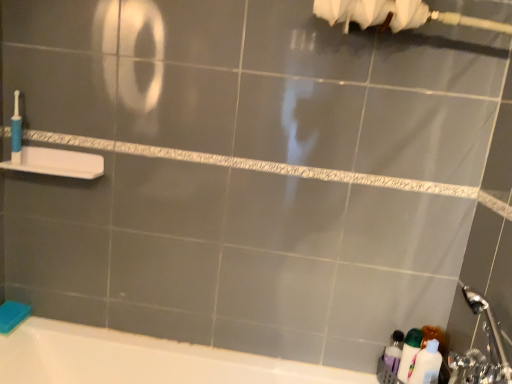
Describe the element at coordinates (57, 163) in the screenshot. The height and width of the screenshot is (384, 512). I see `white plastic shelf at left` at that location.

Where is `blue plastic toothbrush at left`? Image resolution: width=512 pixels, height=384 pixels. blue plastic toothbrush at left is located at coordinates (16, 131).

This screenshot has height=384, width=512. What do you see at coordinates (426, 364) in the screenshot?
I see `translucent plastic bottles at lower right` at bounding box center [426, 364].

Image resolution: width=512 pixels, height=384 pixels. Identify the location of white glossy bottle at lower right. (409, 352).

Could you tell me if blue plastic toothbrush at left is turned towards white glossy bottle at lower right?

No, blue plastic toothbrush at left is not oriented towards white glossy bottle at lower right.

Is blue plastic toothbrush at left to the left of white glossy bottle at lower right from the viewer's perspective?

Indeed, blue plastic toothbrush at left is positioned on the left side of white glossy bottle at lower right.

Considering their positions, is blue plastic toothbrush at left located in front of or behind white glossy bottle at lower right?

Visually, blue plastic toothbrush at left is located behind white glossy bottle at lower right.

Which of these two, white glossy bottle at lower right or white plastic shelf at left, is thinner?

Thinner between the two is white glossy bottle at lower right.

In the scene shown: Is white glossy bottle at lower right to the left of white plastic shelf at left from the viewer's perspective?

No.

Is white glossy bottle at lower right behind white plastic shelf at left?

No, white glossy bottle at lower right is closer to the viewer.

Between point (411, 337) and point (80, 155), which one is positioned behind?

The point (80, 155) is farther from the camera.

Is blue plastic toothbrush at left oriented away from translucent plastic bottles at lower right?

No, blue plastic toothbrush at left is not facing the opposite direction of translucent plastic bottles at lower right.

From a real-world perspective, between blue plastic toothbrush at left and translucent plastic bottles at lower right, who is vertically lower?

translucent plastic bottles at lower right is physically lower.

Is blue plastic toothbrush at left thinner than translucent plastic bottles at lower right?

Yes.

Can you tell me how much blue plastic toothbrush at left and translucent plastic bottles at lower right differ in facing direction?

The angular difference between blue plastic toothbrush at left and translucent plastic bottles at lower right is 18 degrees.

Which is more to the left, translucent plastic bottles at lower right or blue plastic toothbrush at left?

Positioned to the left is blue plastic toothbrush at left.

What are the coordinates of `toiletry on the right of the blue plastic toothbrush at left` in the screenshot? It's located at (426, 364).

Does translucent plastic bottles at lower right have a lesser height compared to blue plastic toothbrush at left?

In fact, translucent plastic bottles at lower right may be taller than blue plastic toothbrush at left.

Is translucent plastic bottles at lower right turned away from blue plastic toothbrush at left?

No, translucent plastic bottles at lower right is not facing the opposite direction of blue plastic toothbrush at left.

Are white plastic shelf at left and translucent plastic bottles at lower right beside each other?

No.

Between white plastic shelf at left and translucent plastic bottles at lower right, which one has larger width?

white plastic shelf at left is wider.

Is white plastic shelf at left in front of or behind translucent plastic bottles at lower right in the image?

white plastic shelf at left is behind translucent plastic bottles at lower right.

From the image's perspective, is white glossy bottle at lower right on top of translucent plastic bottles at lower right?

Yes, from the image's perspective, white glossy bottle at lower right is on top of translucent plastic bottles at lower right.

Does white glossy bottle at lower right have a smaller size compared to translucent plastic bottles at lower right?

Yes.

Is white glossy bottle at lower right beside translucent plastic bottles at lower right?

Indeed, white glossy bottle at lower right and translucent plastic bottles at lower right are beside each other and touching.

From a real-world perspective, which object rests below the other?

In real-world perspective, white glossy bottle at lower right is lower.

From a real-world perspective, relative to white plastic shelf at left, is translucent plastic bottles at lower right vertically above or below?

Clearly, from a real-world perspective, translucent plastic bottles at lower right is below white plastic shelf at left.

Where is `towel bar that appears above the translucent plastic bottles at lower right (from a real-world perspective)`? Image resolution: width=512 pixels, height=384 pixels. towel bar that appears above the translucent plastic bottles at lower right (from a real-world perspective) is located at coordinates (57, 163).

Is translucent plastic bottles at lower right inside or outside of white plastic shelf at left?

translucent plastic bottles at lower right is not inside white plastic shelf at left, it's outside.

From the image's perspective, is translucent plastic bottles at lower right located above white plastic shelf at left?

No, from the image's perspective, translucent plastic bottles at lower right is not over white plastic shelf at left.

At what (x,y) coordinates should I click in order to perform the action: click on cleaning product below the blue plastic toothbrush at left (from a real-world perspective). Please return your answer as a coordinate pair (x, y). Looking at the image, I should click on (409, 352).

The image size is (512, 384). I want to click on cleaning product below the white plastic shelf at left (from the image's perspective), so click(409, 352).

Which object lies nearer to the anchor point white glossy bottle at lower right, white plastic shelf at left or translucent plastic bottles at lower right?

translucent plastic bottles at lower right.

Considering their positions, is blue plastic toothbrush at left positioned closer to translucent plastic bottles at lower right than white glossy bottle at lower right?

The object closer to translucent plastic bottles at lower right is white glossy bottle at lower right.

From the image, which object appears to be nearer to white plastic shelf at left, white glossy bottle at lower right or translucent plastic bottles at lower right?

white glossy bottle at lower right.

Based on their spatial positions, is white glossy bottle at lower right or blue plastic toothbrush at left closer to white plastic shelf at left?

blue plastic toothbrush at left lies closer to white plastic shelf at left than the other object.

Based on their spatial positions, is translucent plastic bottles at lower right or white plastic shelf at left further from blue plastic toothbrush at left?

translucent plastic bottles at lower right.

Looking at the image, which one is located closer to translucent plastic bottles at lower right, white glossy bottle at lower right or white plastic shelf at left?

white glossy bottle at lower right is positioned closer to the anchor translucent plastic bottles at lower right.

Considering their positions, is white glossy bottle at lower right positioned closer to blue plastic toothbrush at left than translucent plastic bottles at lower right?

Among the two, white glossy bottle at lower right is located nearer to blue plastic toothbrush at left.

Based on their spatial positions, is blue plastic toothbrush at left or translucent plastic bottles at lower right further from white plastic shelf at left?

The object further to white plastic shelf at left is translucent plastic bottles at lower right.

The width and height of the screenshot is (512, 384). Identify the location of towel bar between blue plastic toothbrush at left and translucent plastic bottles at lower right in the horizontal direction. (57, 163).

This screenshot has width=512, height=384. Identify the location of cleaning product situated between blue plastic toothbrush at left and translucent plastic bottles at lower right from left to right. (409, 352).

The width and height of the screenshot is (512, 384). Find the location of `towel bar situated between blue plastic toothbrush at left and white glossy bottle at lower right from left to right`. towel bar situated between blue plastic toothbrush at left and white glossy bottle at lower right from left to right is located at coordinates (57, 163).

Find the location of a particular element. The width and height of the screenshot is (512, 384). cleaning product between white plastic shelf at left and translucent plastic bottles at lower right from left to right is located at coordinates (409, 352).